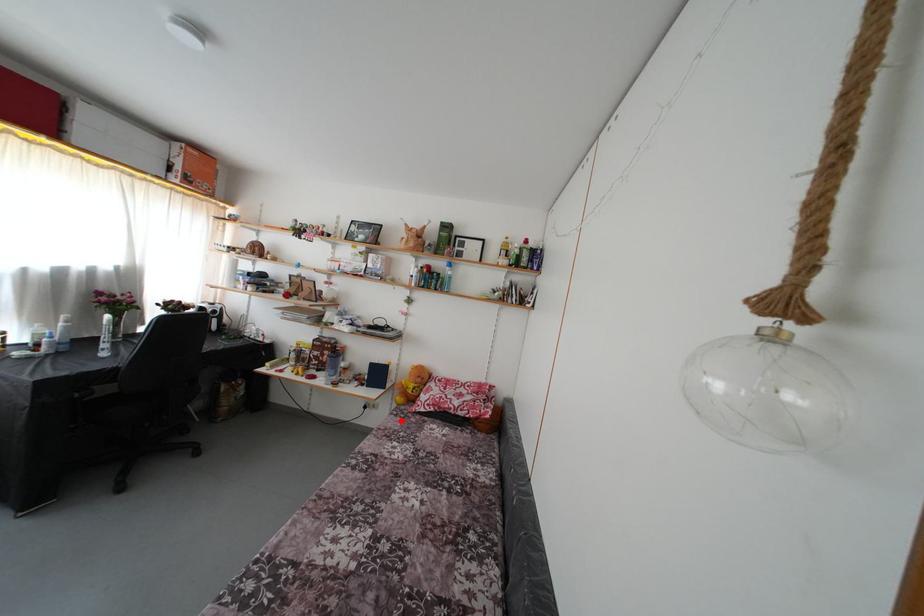
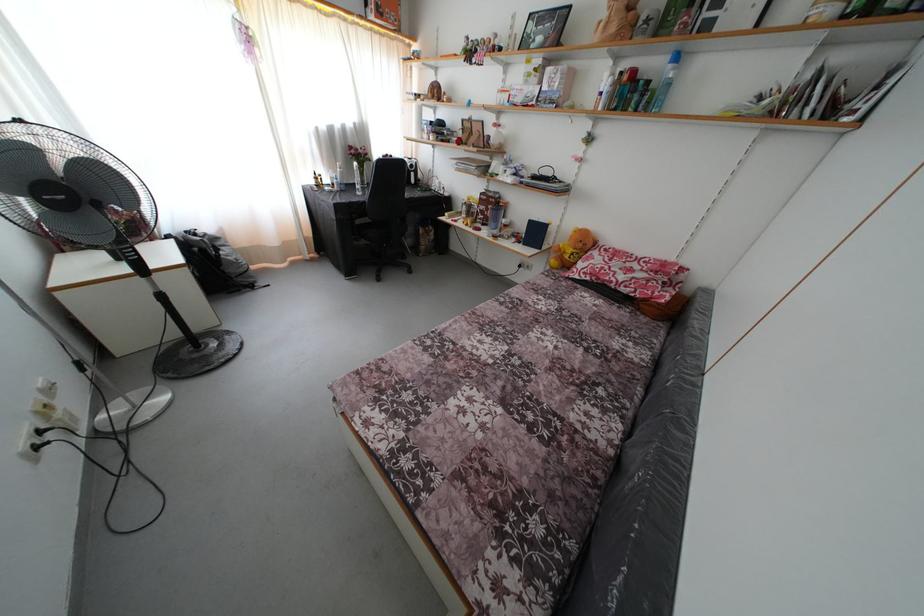
Question: I am providing you with two images of the same scene from different viewpoints. A red point is marked on the first image. Can you still see the location of the red point in image 2?

Choices:
 (A) Yes
 (B) No

Answer: (A)